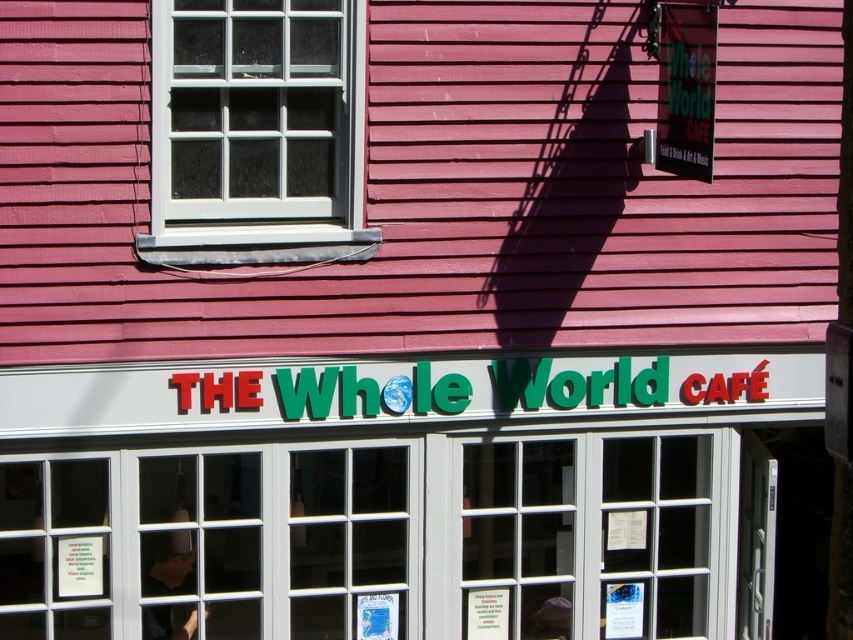
You are a delivery person trying to determine the best side to approach the cafe to avoid the sun glare. The white glass window at upper left and the green plastic sign at upper right are both reflective. Which object should you avoid looking at to minimize glare?

You should avoid looking at the white glass window at upper left because it is wider and thus reflects more light, causing more glare than the green plastic sign at upper right.

You are standing in front of The Whole World Cafe and want to read both the white glass window at upper left and the green plastic sign at upper right. Which object is closer to you?

The white glass window at upper left is closer to you because the green plastic sign at upper right is behind it.

Consider the image. You are standing in front of the cafe and want to look through the white glass window at upper left. Can you tell me the exact coordinates where the window is located?

The white glass window at upper left is located at coordinates point (257, 122).